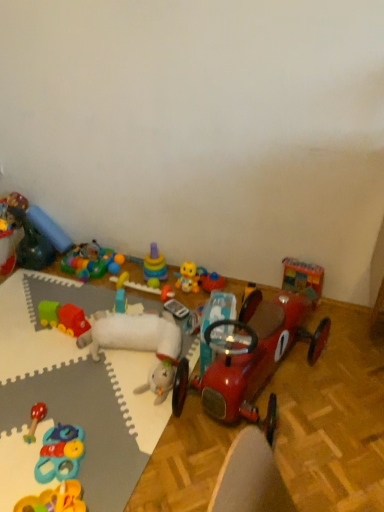
The height and width of the screenshot is (512, 384). Identify the location of vacant region to the left of white plush lamb at lower left, acting as the eighth toy starting from the left. (42, 344).